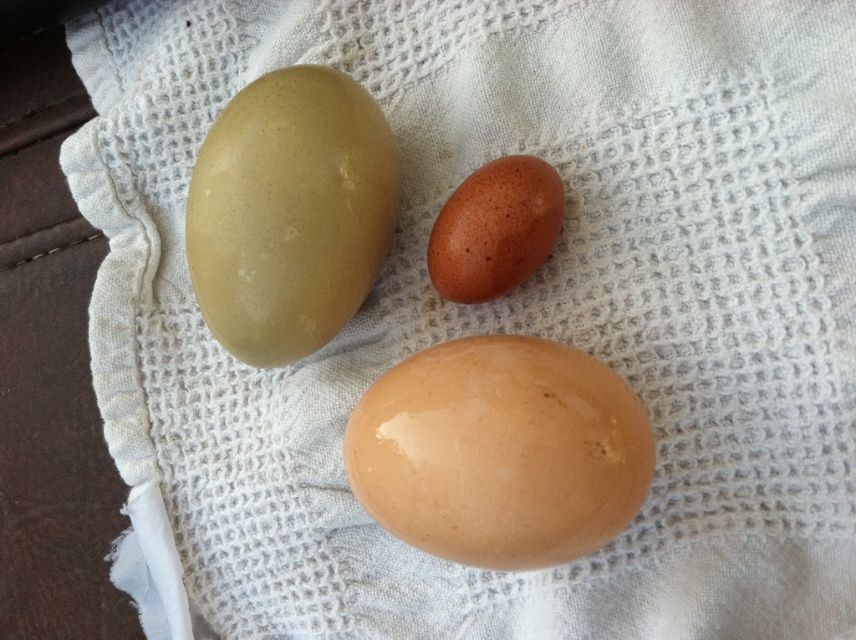
Question: Based on their relative distances, which object is nearer to the speckled brown egg at center?

Choices:
 (A) matte brown egg at upper left
 (B) glossy brown egg at center

Answer: (B)

Question: Which point is closer to the camera?

Choices:
 (A) (348, 308)
 (B) (440, 262)

Answer: (B)

Question: Which of the following is the closest to the observer?

Choices:
 (A) matte brown egg at upper left
 (B) speckled brown egg at center

Answer: (A)

Question: Does glossy brown egg at center have a lesser width compared to speckled brown egg at center?

Choices:
 (A) yes
 (B) no

Answer: (B)

Question: Is matte brown egg at upper left below speckled brown egg at center?

Choices:
 (A) yes
 (B) no

Answer: (B)

Question: From the image, what is the correct spatial relationship of matte brown egg at upper left in relation to speckled brown egg at center?

Choices:
 (A) right
 (B) left

Answer: (B)